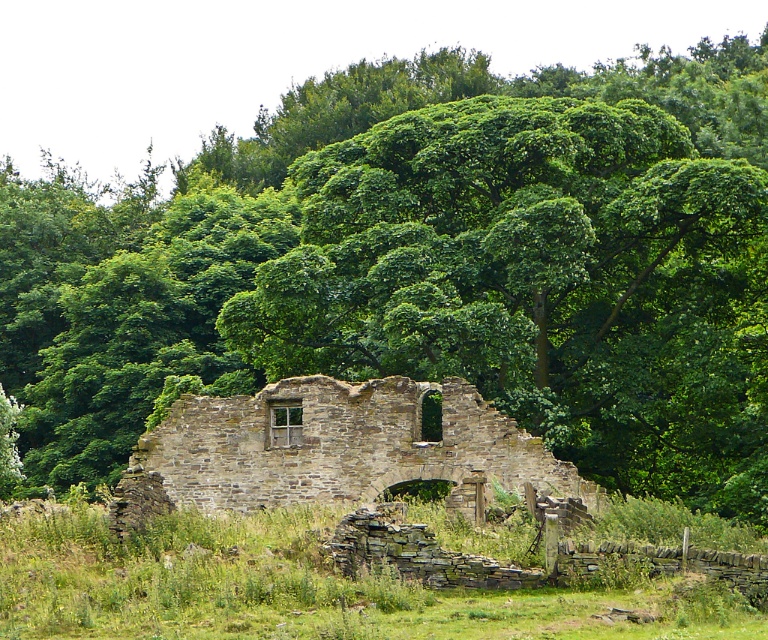
Can you confirm if green grass at center is smaller than rustic stone ruins at center?

Incorrect, green grass at center is not smaller in size than rustic stone ruins at center.

Which is in front, point (85, 580) or point (356, 426)?

Positioned in front is point (85, 580).

Which is in front, point (714, 586) or point (184, 449)?

Point (714, 586)

Find the location of a particular element. The image size is (768, 640). green grass at center is located at coordinates (305, 588).